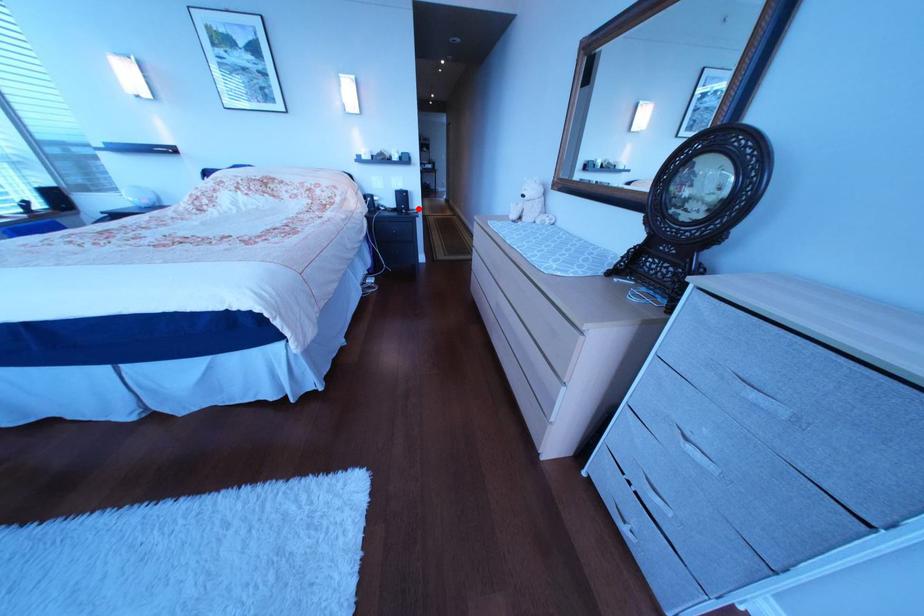
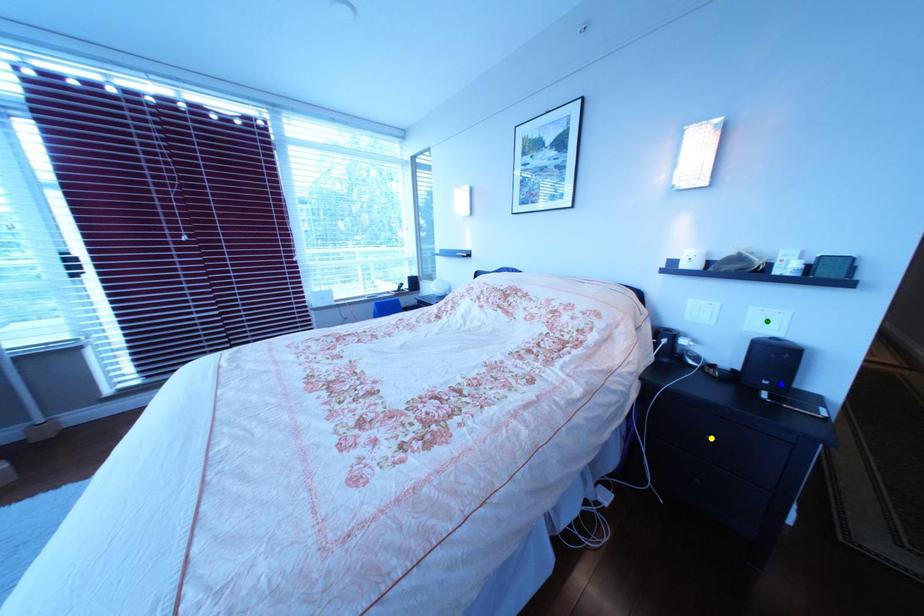
Question: I am providing you with two images of the same scene from different viewpoints. A red point is marked on the first image. You are given multiple points on the second image. Which point in image 2 is actually the same real-world point as the red point in image 1?

Choices:
 (A) blue point
 (B) yellow point
 (C) green point

Answer: (A)